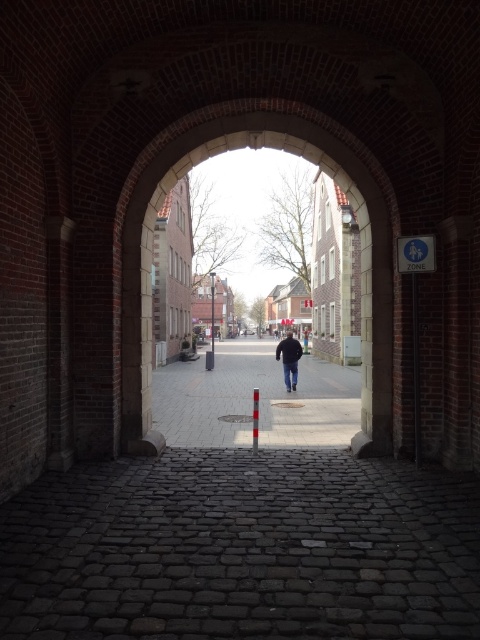
Question: Among these objects, which one is nearest to the camera?

Choices:
 (A) dark blue jeans at center
 (B) brick tunnel at center
 (C) smooth stone pavement at center

Answer: (B)

Question: Which point is closer to the camera?

Choices:
 (A) smooth stone pavement at center
 (B) brick tunnel at center
 (C) dark blue jeans at center

Answer: (B)

Question: Among these points, which one is nearest to the camera?

Choices:
 (A) click(349, 416)
 (B) click(367, 256)
 (C) click(294, 369)

Answer: (B)

Question: Does smooth stone pavement at center have a lesser width compared to dark blue jeans at center?

Choices:
 (A) yes
 (B) no

Answer: (B)

Question: Is brick tunnel at center thinner than dark blue jeans at center?

Choices:
 (A) no
 (B) yes

Answer: (B)

Question: Does brick tunnel at center appear on the left side of smooth stone pavement at center?

Choices:
 (A) no
 (B) yes

Answer: (A)